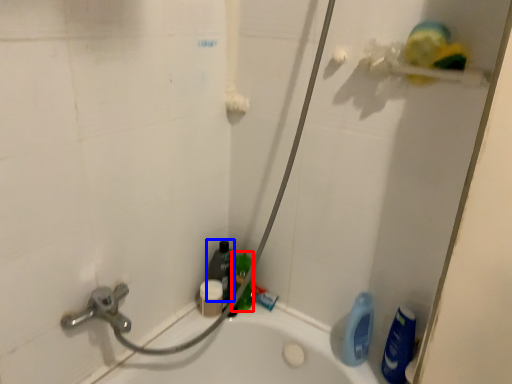
Question: Among these objects, which one is farthest to the camera, cleaning product (highlighted by a red box) or cleaning product (highlighted by a blue box)?

Choices:
 (A) cleaning product
 (B) cleaning product

Answer: (B)